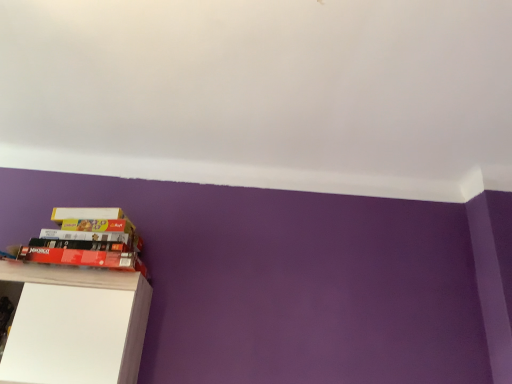
The image size is (512, 384). Describe the element at coordinates (75, 325) in the screenshot. I see `white matte cabinet at lower left` at that location.

The image size is (512, 384). Describe the element at coordinates (82, 257) in the screenshot. I see `red matte paperback book at lower left, which is counted as the second paperback book, starting from the top` at that location.

How much space does white matte book at upper left, acting as the 2th paperback book starting from the bottom, occupy vertically?

7.20 centimeters.

Where is `white matte cabinet at lower left`? The width and height of the screenshot is (512, 384). white matte cabinet at lower left is located at coordinates (75, 325).

Is white matte book at upper left, the first paperback book viewed from the top, oriented towards white matte cabinet at lower left?

No.

What's the angular difference between white matte book at upper left, acting as the 2th paperback book starting from the bottom, and white matte cabinet at lower left's facing directions?

4.72 degrees separate the facing orientations of white matte book at upper left, acting as the 2th paperback book starting from the bottom, and white matte cabinet at lower left.

Considering the sizes of white matte book at upper left, the first paperback book viewed from the top, and white matte cabinet at lower left in the image, is white matte book at upper left, the first paperback book viewed from the top, wider or thinner than white matte cabinet at lower left?

Clearly, white matte book at upper left, the first paperback book viewed from the top, has less width compared to white matte cabinet at lower left.

From their relative heights in the image, would you say red matte paperback book at lower left, which is the first paperback book in bottom-to-top order, is taller or shorter than white matte cabinet at lower left?

Clearly, red matte paperback book at lower left, which is the first paperback book in bottom-to-top order, is shorter compared to white matte cabinet at lower left.

Which of these two, red matte paperback book at lower left, which is the first paperback book in bottom-to-top order, or white matte cabinet at lower left, is bigger?

white matte cabinet at lower left is bigger.

Could you tell me if red matte paperback book at lower left, which is counted as the second paperback book, starting from the top, is facing white matte cabinet at lower left?

No.

How different are the orientations of red matte paperback book at lower left, which is the first paperback book in bottom-to-top order, and white matte cabinet at lower left in degrees?

1.19 degrees.

Looking at this image, from a real-world perspective, which is physically below, white matte cabinet at lower left or white matte book at upper left, acting as the 2th paperback book starting from the bottom?

white matte cabinet at lower left, from a real-world perspective.

Consider the image. Is white matte cabinet at lower left looking in the opposite direction of white matte book at upper left, the first paperback book viewed from the top?

white matte cabinet at lower left is not turned away from white matte book at upper left, the first paperback book viewed from the top.

Which object is closer to the camera taking this photo, white matte cabinet at lower left or white matte book at upper left, acting as the 2th paperback book starting from the bottom?

white matte cabinet at lower left is more forward.

Looking at this image, would you say white matte cabinet at lower left is to the left or to the right of white matte book at upper left, acting as the 2th paperback book starting from the bottom, in the picture?

white matte cabinet at lower left is to the left of white matte book at upper left, acting as the 2th paperback book starting from the bottom.

From a real-world perspective, between white matte cabinet at lower left and red matte paperback book at lower left, which is the first paperback book in bottom-to-top order, who is vertically higher?

red matte paperback book at lower left, which is the first paperback book in bottom-to-top order, is physically above.

From the image's perspective, which is below, white matte cabinet at lower left or red matte paperback book at lower left, which is counted as the second paperback book, starting from the top?

From the image's view, white matte cabinet at lower left is below.

I want to click on the 1st paperback book behind the white matte cabinet at lower left, counting from the anchor's position, so click(82, 257).

Considering the relative positions of red matte paperback book at lower left, which is counted as the second paperback book, starting from the top, and white matte book at upper left, acting as the 2th paperback book starting from the bottom, in the image provided, is red matte paperback book at lower left, which is counted as the second paperback book, starting from the top, to the right of white matte book at upper left, acting as the 2th paperback book starting from the bottom, from the viewer's perspective?

Incorrect, red matte paperback book at lower left, which is counted as the second paperback book, starting from the top, is not on the right side of white matte book at upper left, acting as the 2th paperback book starting from the bottom.

How many degrees apart are the facing directions of red matte paperback book at lower left, which is the first paperback book in bottom-to-top order, and white matte book at upper left, the first paperback book viewed from the top?

Result: The angular difference between red matte paperback book at lower left, which is the first paperback book in bottom-to-top order, and white matte book at upper left, the first paperback book viewed from the top, is 3.54 degrees.

Which is correct: red matte paperback book at lower left, which is counted as the second paperback book, starting from the top, is inside white matte book at upper left, the first paperback book viewed from the top, or outside of it?

red matte paperback book at lower left, which is counted as the second paperback book, starting from the top, is not inside white matte book at upper left, the first paperback book viewed from the top, it's outside.

Where is `paperback book below the white matte book at upper left, acting as the 2th paperback book starting from the bottom (from the image's perspective)`? The image size is (512, 384). paperback book below the white matte book at upper left, acting as the 2th paperback book starting from the bottom (from the image's perspective) is located at coordinates (82, 257).

Is white matte book at upper left, the first paperback book viewed from the top, touching red matte paperback book at lower left, which is the first paperback book in bottom-to-top order?

No, white matte book at upper left, the first paperback book viewed from the top, is not in contact with red matte paperback book at lower left, which is the first paperback book in bottom-to-top order.

Is red matte paperback book at lower left, which is counted as the second paperback book, starting from the top, at the back of white matte book at upper left, acting as the 2th paperback book starting from the bottom?

No, white matte book at upper left, acting as the 2th paperback book starting from the bottom,'s orientation is not away from red matte paperback book at lower left, which is counted as the second paperback book, starting from the top.

Based on their sizes in the image, would you say white matte book at upper left, the first paperback book viewed from the top, is bigger or smaller than red matte paperback book at lower left, which is the first paperback book in bottom-to-top order?

Considering their sizes, white matte book at upper left, the first paperback book viewed from the top, takes up less space than red matte paperback book at lower left, which is the first paperback book in bottom-to-top order.

Identify the location of shelf below the white matte book at upper left, the first paperback book viewed from the top (from the image's perspective). This screenshot has width=512, height=384. (75, 325).

Find the location of a particular element. Image resolution: width=512 pixels, height=384 pixels. shelf on the left side of red matte paperback book at lower left, which is the first paperback book in bottom-to-top order is located at coordinates (75, 325).

Which object lies further to the anchor point red matte paperback book at lower left, which is counted as the second paperback book, starting from the top, white matte cabinet at lower left or white matte book at upper left, acting as the 2th paperback book starting from the bottom?

white matte cabinet at lower left lies further to red matte paperback book at lower left, which is counted as the second paperback book, starting from the top, than the other object.

Considering their positions, is red matte paperback book at lower left, which is the first paperback book in bottom-to-top order, positioned closer to white matte book at upper left, the first paperback book viewed from the top, than white matte cabinet at lower left?

red matte paperback book at lower left, which is the first paperback book in bottom-to-top order, is positioned closer to the anchor white matte book at upper left, the first paperback book viewed from the top.

Considering their positions, is white matte cabinet at lower left positioned closer to white matte book at upper left, the first paperback book viewed from the top, than red matte paperback book at lower left, which is the first paperback book in bottom-to-top order?

red matte paperback book at lower left, which is the first paperback book in bottom-to-top order, is closer to white matte book at upper left, the first paperback book viewed from the top.

Looking at the image, which one is located closer to white matte cabinet at lower left, white matte book at upper left, acting as the 2th paperback book starting from the bottom, or red matte paperback book at lower left, which is counted as the second paperback book, starting from the top?

The object closer to white matte cabinet at lower left is red matte paperback book at lower left, which is counted as the second paperback book, starting from the top.

When comparing their distances from red matte paperback book at lower left, which is the first paperback book in bottom-to-top order, does white matte book at upper left, the first paperback book viewed from the top, or white matte cabinet at lower left seem further?

Among the two, white matte cabinet at lower left is located further to red matte paperback book at lower left, which is the first paperback book in bottom-to-top order.

Considering their positions, is red matte paperback book at lower left, which is counted as the second paperback book, starting from the top, positioned further to white matte cabinet at lower left than white matte book at upper left, the first paperback book viewed from the top?

white matte book at upper left, the first paperback book viewed from the top, lies further to white matte cabinet at lower left than the other object.

The height and width of the screenshot is (384, 512). Find the location of `paperback book between white matte book at upper left, the first paperback book viewed from the top, and white matte cabinet at lower left, in the vertical direction`. paperback book between white matte book at upper left, the first paperback book viewed from the top, and white matte cabinet at lower left, in the vertical direction is located at coordinates (82, 257).